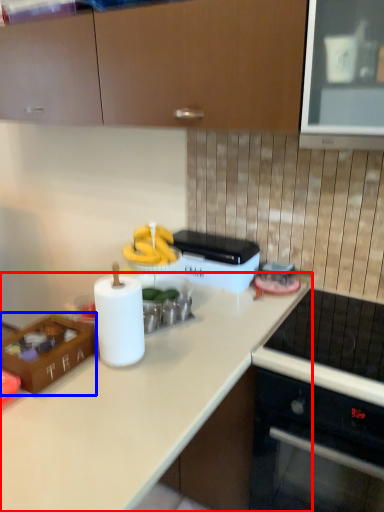
Question: Among these objects, which one is nearest to the camera, countertop (highlighted by a red box) or kitchen appliance (highlighted by a blue box)?

Choices:
 (A) countertop
 (B) kitchen appliance

Answer: (A)